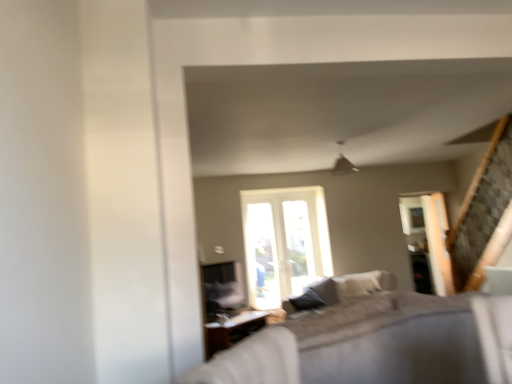
Question: From the image's perspective, is wooden table at lower center over textured beige couch at center?

Choices:
 (A) yes
 (B) no

Answer: (B)

Question: Is textured beige couch at center completely or partially inside wooden table at lower center?

Choices:
 (A) yes
 (B) no

Answer: (B)

Question: Considering the relative positions of wooden table at lower center and textured beige couch at center in the image provided, is wooden table at lower center to the right of textured beige couch at center from the viewer's perspective?

Choices:
 (A) no
 (B) yes

Answer: (A)

Question: From a real-world perspective, is wooden table at lower center physically below textured beige couch at center?

Choices:
 (A) yes
 (B) no

Answer: (A)

Question: Considering the relative sizes of wooden table at lower center and textured beige couch at center in the image provided, is wooden table at lower center shorter than textured beige couch at center?

Choices:
 (A) yes
 (B) no

Answer: (A)

Question: From the image's perspective, is wooden table at lower center located beneath textured beige couch at center?

Choices:
 (A) no
 (B) yes

Answer: (B)

Question: From the image's perspective, does wooden table at lower center appear lower than clear glass screen door at right?

Choices:
 (A) no
 (B) yes

Answer: (B)

Question: From the image's perspective, is wooden table at lower center located above clear glass screen door at right?

Choices:
 (A) yes
 (B) no

Answer: (B)

Question: Considering the relative positions of wooden table at lower center and clear glass screen door at right in the image provided, is wooden table at lower center to the left of clear glass screen door at right from the viewer's perspective?

Choices:
 (A) yes
 (B) no

Answer: (A)

Question: Is wooden table at lower center bigger than clear glass screen door at right?

Choices:
 (A) yes
 (B) no

Answer: (A)

Question: Is wooden table at lower center shorter than clear glass screen door at right?

Choices:
 (A) yes
 (B) no

Answer: (A)

Question: Is the depth of wooden table at lower center less than that of clear glass screen door at right?

Choices:
 (A) yes
 (B) no

Answer: (A)

Question: Does textured beige couch at center have a greater height compared to wooden table at lower center?

Choices:
 (A) no
 (B) yes

Answer: (B)